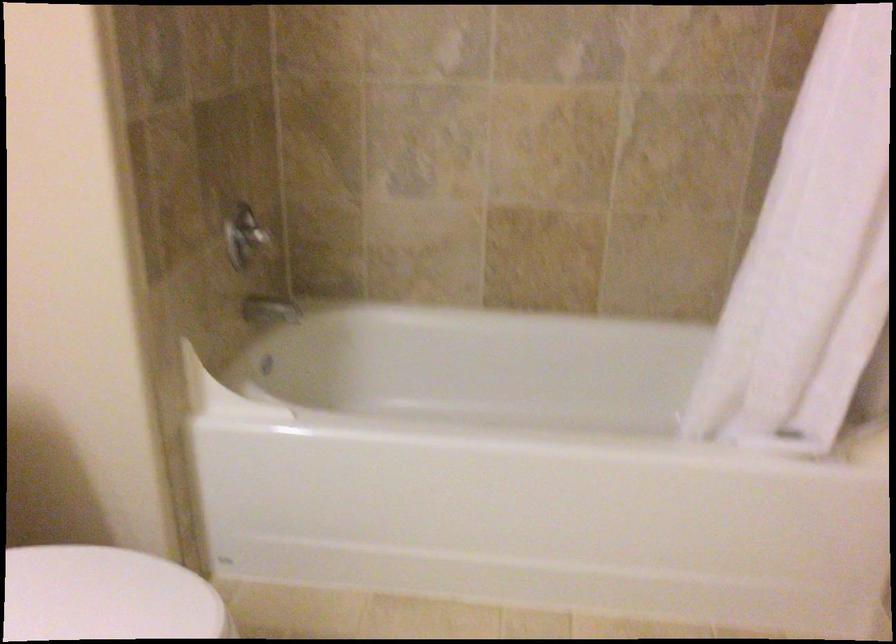
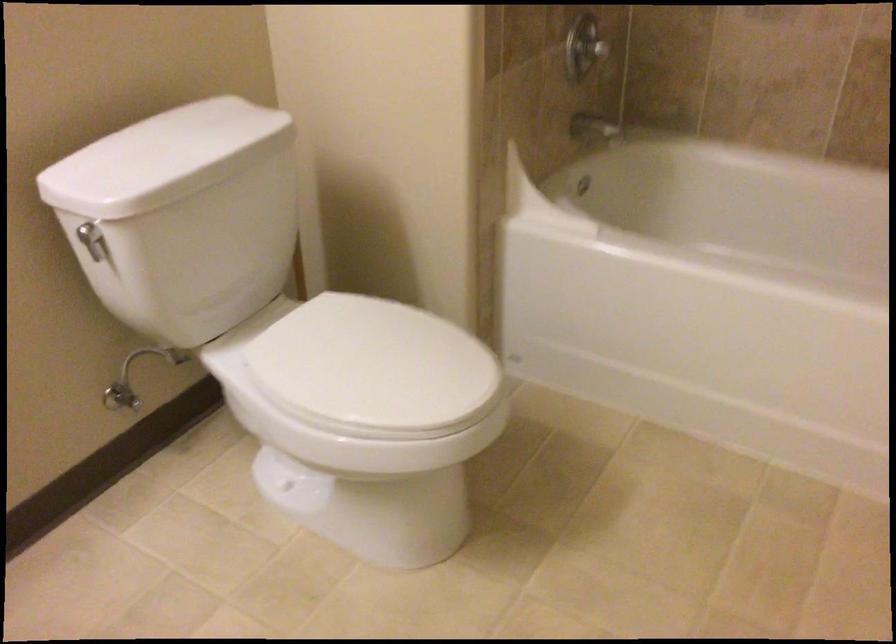
Which direction would the cameraman need to move to produce the second image?

The cameraman walked toward right, backward.